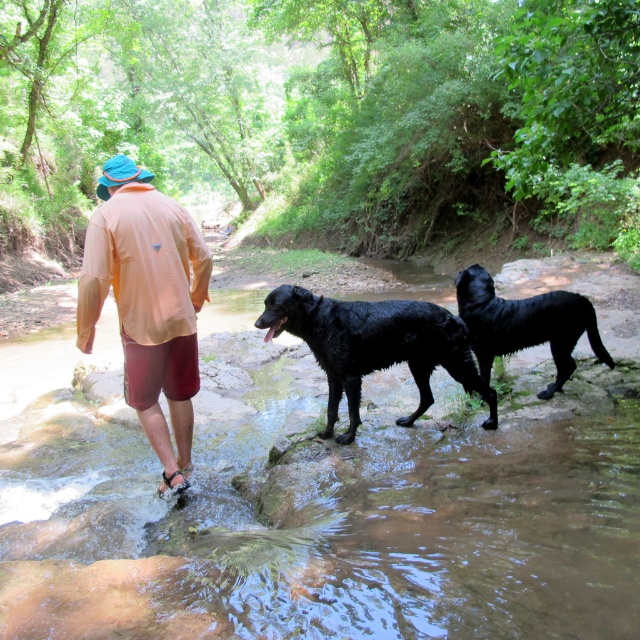
Does clear water at stream center have a greater height compared to orange fabric shirt at center?

Yes, clear water at stream center is taller than orange fabric shirt at center.

Between point (637, 380) and point (122, 314), which one is positioned behind?

The point (637, 380) is behind.

This screenshot has height=640, width=640. In order to click on clear water at stream center in this screenshot , I will do `click(314, 502)`.

Can you confirm if orange fabric shirt at center is positioned to the left of wet glossy black dog at center?

Indeed, orange fabric shirt at center is positioned on the left side of wet glossy black dog at center.

Consider the image. Is orange fabric shirt at center behind wet glossy black dog at center?

Yes, it is.

Does point (192, 369) lie in front of point (289, 296)?

Yes, point (192, 369) is closer to viewer.

Find the location of a particular element. orange fabric shirt at center is located at coordinates (147, 301).

Is orange fabric shirt at center to the left of shiny black dog at center from the viewer's perspective?

Correct, you'll find orange fabric shirt at center to the left of shiny black dog at center.

Which is behind, point (173, 422) or point (541, 394)?

The point (541, 394) is behind.

Who is more forward, [172,285] or [573,337]?

Point [172,285] is in front.

You are a GUI agent. You are given a task and a screenshot of the screen. Output one action in this format:
    pyautogui.click(x=<x>, y=<y>)
    Task: Click on the orange fabric shirt at center
    
    Given the screenshot: What is the action you would take?
    pyautogui.click(x=147, y=301)